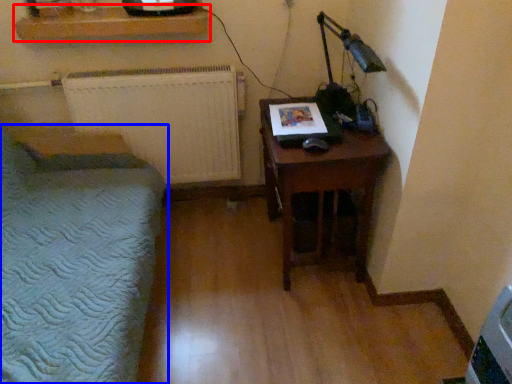
Question: Which of the following is the farthest to the observer, shelf (highlighted by a red box) or furniture (highlighted by a blue box)?

Choices:
 (A) shelf
 (B) furniture

Answer: (A)